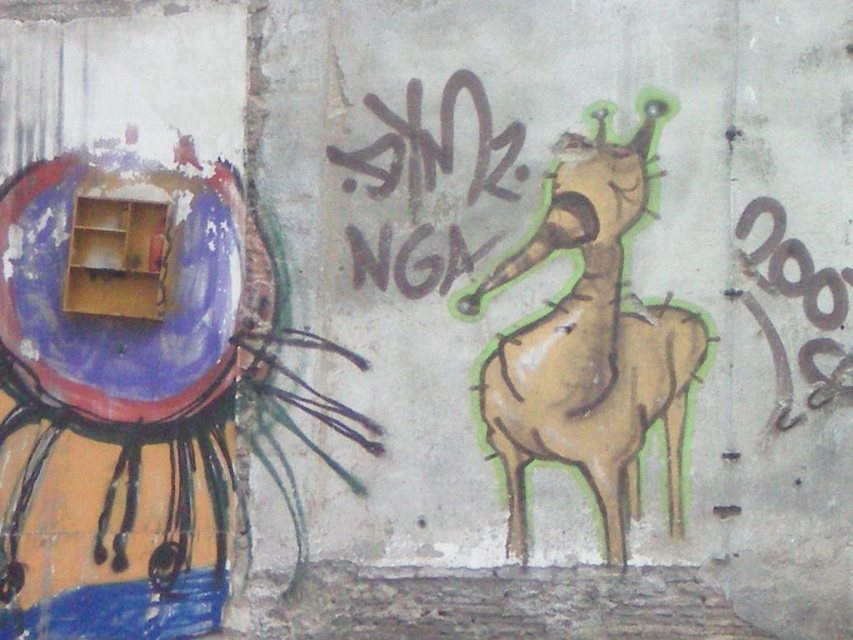
Question: Does beige textured giraffe at center appear under black graffiti at center?

Choices:
 (A) no
 (B) yes

Answer: (B)

Question: Is beige textured giraffe at center closer to camera compared to black graffiti at center?

Choices:
 (A) no
 (B) yes

Answer: (B)

Question: Which of the following is the farthest from the observer?

Choices:
 (A) beige textured giraffe at center
 (B) black graffiti at right
 (C) black graffiti at center

Answer: (C)

Question: Which point appears closest to the camera in this image?

Choices:
 (A) (497, 268)
 (B) (344, 184)
 (C) (828, 321)

Answer: (C)

Question: Is beige textured giraffe at center above black graffiti at center?

Choices:
 (A) yes
 (B) no

Answer: (B)

Question: Which point is closer to the camera?

Choices:
 (A) (851, 284)
 (B) (672, 416)
 (C) (405, 154)

Answer: (B)